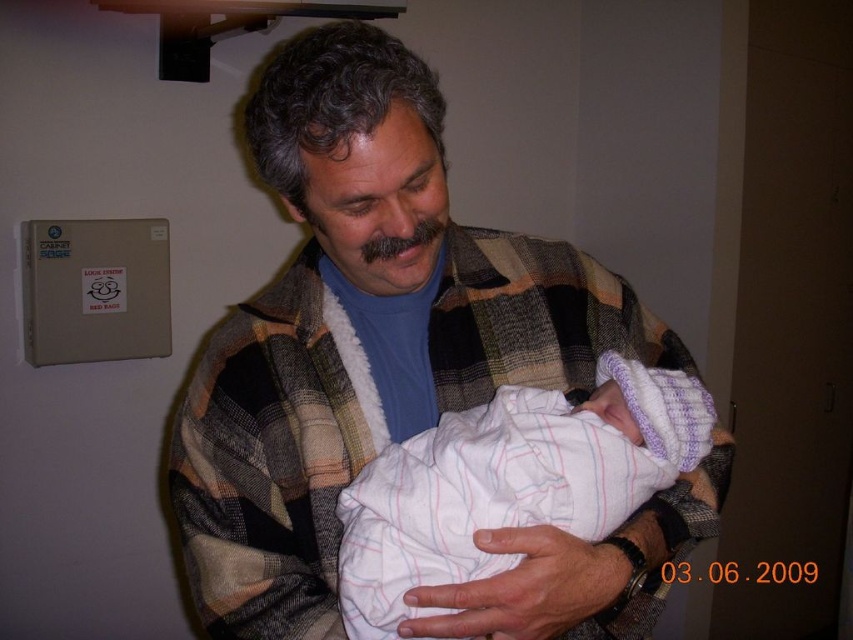
Question: Which point is closer to the camera taking this photo?

Choices:
 (A) (219, 371)
 (B) (445, 458)

Answer: (B)

Question: Does plaid woolen shawl at center have a smaller size compared to white soft fabric newborn at center?

Choices:
 (A) no
 (B) yes

Answer: (A)

Question: Which object appears closest to the camera in this image?

Choices:
 (A) plaid woolen shawl at center
 (B) white soft fabric newborn at center

Answer: (A)

Question: Which point appears farthest from the camera in this image?

Choices:
 (A) (401, 460)
 (B) (267, 362)

Answer: (B)

Question: Can you confirm if plaid woolen shawl at center is positioned to the right of white soft fabric newborn at center?

Choices:
 (A) no
 (B) yes

Answer: (A)

Question: Does plaid woolen shawl at center have a greater width compared to white soft fabric newborn at center?

Choices:
 (A) yes
 (B) no

Answer: (A)